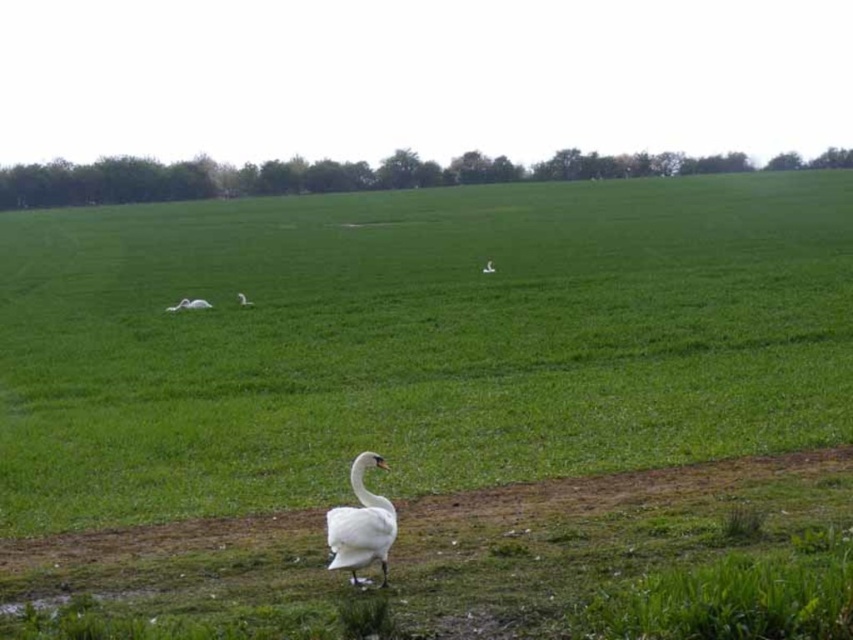
Question: Among these objects, which one is farthest from the camera?

Choices:
 (A) white glossy swan at center
 (B) white matte swan at center
 (C) green grass at center

Answer: (B)

Question: Which object is closer to the camera taking this photo?

Choices:
 (A) green grass at center
 (B) white matte swan at center
 (C) white feathered swan at center
 (D) white matte goose at center

Answer: (A)

Question: Is green grass at center above white matte goose at center?

Choices:
 (A) yes
 (B) no

Answer: (A)

Question: Is green grass at center wider than white feathered swan at center?

Choices:
 (A) yes
 (B) no

Answer: (A)

Question: Estimate the real-world distances between objects in this image. Which object is farther from the white feathered swan at center?

Choices:
 (A) white glossy swan at center
 (B) white matte swan at center
 (C) white matte goose at center
 (D) green grass at center

Answer: (D)

Question: Can you confirm if white glossy swan at center is thinner than white feathered swan at center?

Choices:
 (A) yes
 (B) no

Answer: (A)